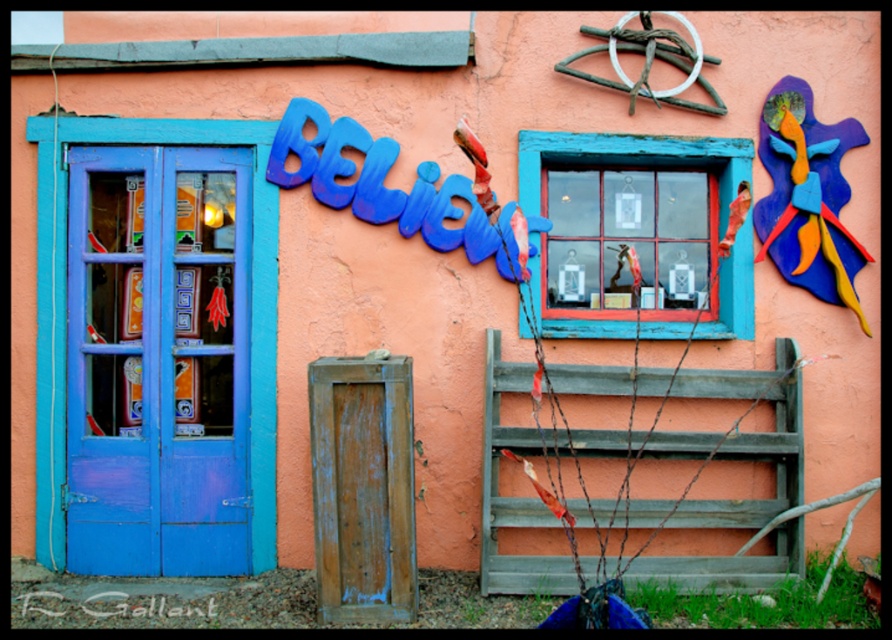
You are standing in front of the building and want to touch both the blue painted wood door at left and the wooden window at center. Which one can you reach first without moving your position?

You can reach the blue painted wood door at left first because it is closer to you than the wooden window at center, which is further away.

You are an architect designing a new building and want to ensure that the entrance area has enough space for both the blue painted wood door at left and the wooden window at center. Based on their widths, which object should be placed first if you want to prioritize the wider one?

The wooden window at center is wider than the blue painted wood door at left, so you should place the wooden window at center first to prioritize the wider object.